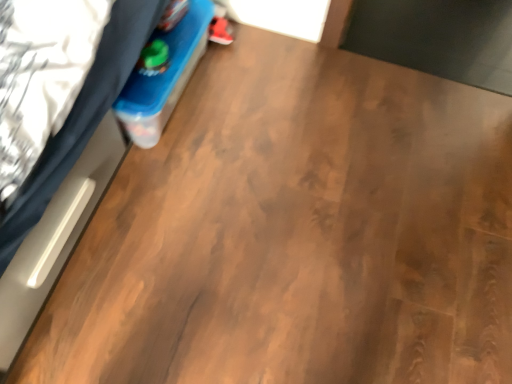
You are a GUI agent. You are given a task and a screenshot of the screen. Output one action in this format:
    pyautogui.click(x=<x>, y=<y>)
    Task: Click on the vacant area in front of matte red sneaker at upper center
    This screenshot has height=384, width=512.
    Given the screenshot: What is the action you would take?
    pyautogui.click(x=225, y=69)